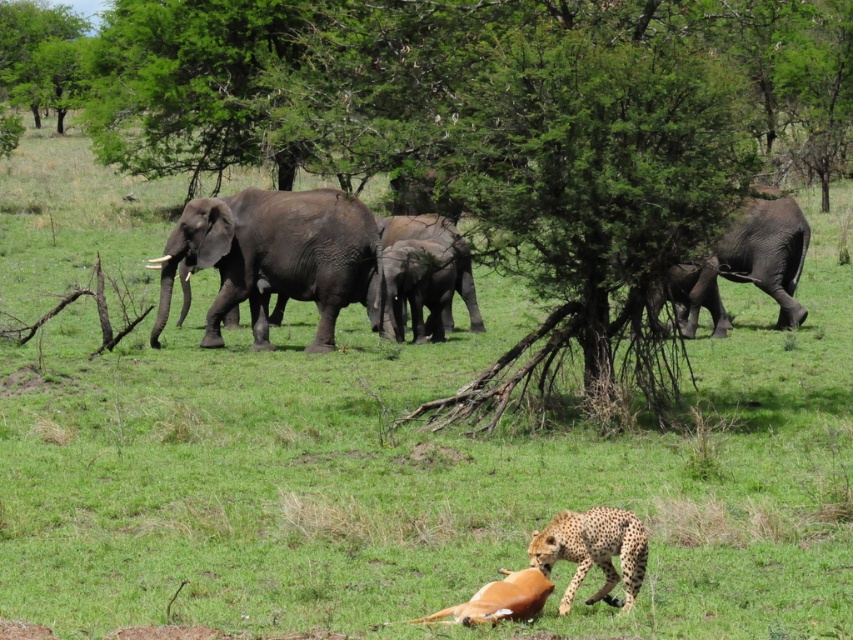
You are a wildlife photographer standing at the origin point of the image coordinate system. You want to take a photo of the spotted fur cheetah at lower center. According to the coordinate system, where exactly is the spotted fur cheetah located?

The spotted fur cheetah at lower center is located at coordinate point (593, 550).

Consider the image. You are a wildlife photographer trying to capture a photo of the gray textured elephant at left and the spotted fur cheetah at lower center. If you want to ensure both animals are in the frame, which animal should you focus on first to account for their sizes?

The gray textured elephant at left is larger in width than the spotted fur cheetah at lower center, so you should focus on the gray textured elephant at left first to ensure it fits properly in the frame.

You are a wildlife photographer observing the scene. You want to capture a photo where the spotted fur cheetah at lower center and the gray matte elephant at center are both visible. Which animal should you focus on first if you want to ensure both are in the frame?

The spotted fur cheetah at lower center is shorter than the gray matte elephant at center, so you should focus on the gray matte elephant at center first to ensure both are in the frame.